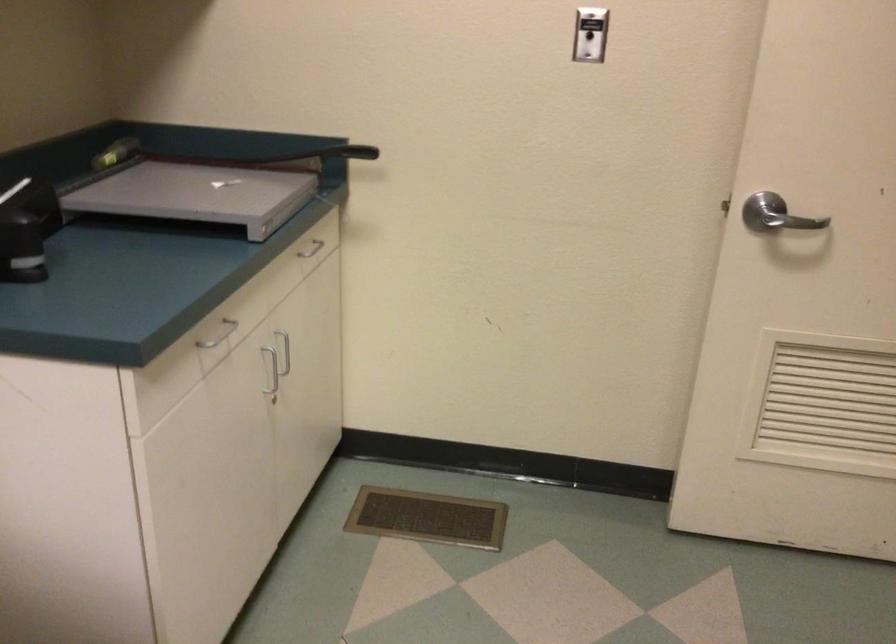
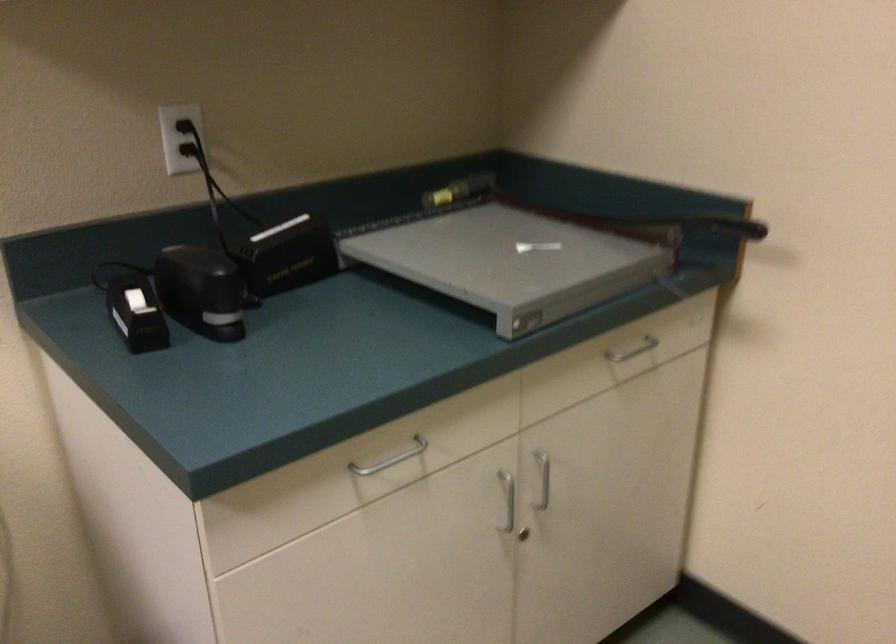
Locate, in the second image, the point that corresponds to (x=216, y=337) in the first image.

(391, 459)